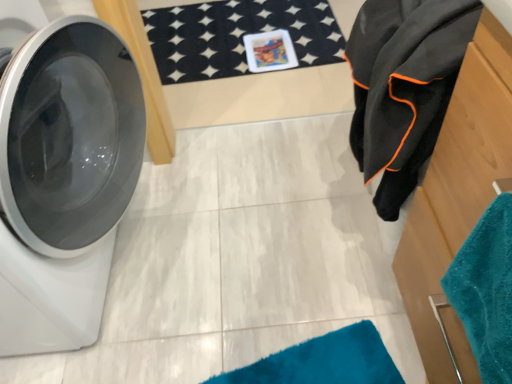
Question: Is white glossy washing machine at left oriented towards teal soft towel at right?

Choices:
 (A) yes
 (B) no

Answer: (B)

Question: Considering the relative sizes of white glossy washing machine at left and teal soft towel at right in the image provided, is white glossy washing machine at left bigger than teal soft towel at right?

Choices:
 (A) yes
 (B) no

Answer: (A)

Question: Is teal soft towel at right at the back of white glossy washing machine at left?

Choices:
 (A) no
 (B) yes

Answer: (A)

Question: Considering the relative sizes of white glossy washing machine at left and teal soft towel at right in the image provided, is white glossy washing machine at left taller than teal soft towel at right?

Choices:
 (A) yes
 (B) no

Answer: (A)

Question: Is white glossy washing machine at left wider than teal soft towel at right?

Choices:
 (A) no
 (B) yes

Answer: (B)

Question: Does white glossy washing machine at left touch teal soft towel at right?

Choices:
 (A) no
 (B) yes

Answer: (A)

Question: From the image's perspective, would you say wooden dresser at right is shown under white glossy washing machine at left?

Choices:
 (A) yes
 (B) no

Answer: (A)

Question: Is wooden dresser at right smaller than white glossy washing machine at left?

Choices:
 (A) no
 (B) yes

Answer: (B)

Question: Can white glossy washing machine at left be found inside wooden dresser at right?

Choices:
 (A) no
 (B) yes

Answer: (A)

Question: Considering the relative sizes of wooden dresser at right and white glossy washing machine at left in the image provided, is wooden dresser at right shorter than white glossy washing machine at left?

Choices:
 (A) no
 (B) yes

Answer: (B)

Question: Is wooden dresser at right outside of white glossy washing machine at left?

Choices:
 (A) no
 (B) yes

Answer: (B)

Question: Can you confirm if wooden dresser at right is positioned to the left of white glossy washing machine at left?

Choices:
 (A) no
 (B) yes

Answer: (A)

Question: Would you say wooden dresser at right is a long distance from black fleece towel at right?

Choices:
 (A) yes
 (B) no

Answer: (B)